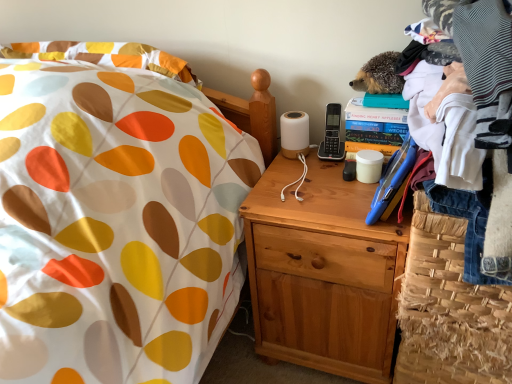
Question: Should I look upward or downward to see white cotton shirt at upper right?

Choices:
 (A) up
 (B) down

Answer: (A)

Question: From the image's perspective, does white cotton shirt at upper right appear lower than natural wood nightstand at center?

Choices:
 (A) yes
 (B) no

Answer: (B)

Question: Would you say white cotton shirt at upper right is a long distance from natural wood nightstand at center?

Choices:
 (A) no
 (B) yes

Answer: (A)

Question: Is white cotton shirt at upper right thinner than natural wood nightstand at center?

Choices:
 (A) no
 (B) yes

Answer: (A)

Question: Is white cotton shirt at upper right wider than natural wood nightstand at center?

Choices:
 (A) no
 (B) yes

Answer: (B)

Question: Is white cotton shirt at upper right taller than natural wood nightstand at center?

Choices:
 (A) no
 (B) yes

Answer: (A)

Question: Is white cotton shirt at upper right not inside natural wood nightstand at center?

Choices:
 (A) no
 (B) yes

Answer: (B)

Question: Does woven straw basket at lower right have a lesser height compared to white cotton shirt at upper right?

Choices:
 (A) no
 (B) yes

Answer: (B)

Question: Could you tell me if woven straw basket at lower right is facing white cotton shirt at upper right?

Choices:
 (A) yes
 (B) no

Answer: (B)

Question: From the image's perspective, does woven straw basket at lower right appear lower than white cotton shirt at upper right?

Choices:
 (A) no
 (B) yes

Answer: (B)

Question: Considering the relative positions of woven straw basket at lower right and white cotton shirt at upper right in the image provided, is woven straw basket at lower right to the right of white cotton shirt at upper right from the viewer's perspective?

Choices:
 (A) no
 (B) yes

Answer: (B)

Question: Is woven straw basket at lower right looking in the opposite direction of white cotton shirt at upper right?

Choices:
 (A) yes
 (B) no

Answer: (B)

Question: From a real-world perspective, is woven straw basket at lower right on white cotton shirt at upper right?

Choices:
 (A) yes
 (B) no

Answer: (B)

Question: Is natural wood nightstand at center positioned far away from woven straw basket at lower right?

Choices:
 (A) yes
 (B) no

Answer: (B)